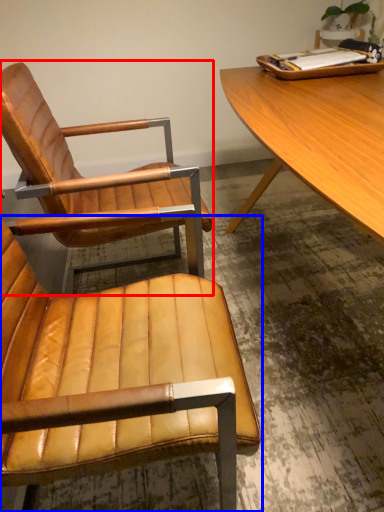
Question: Which object is further to the camera taking this photo, chair (highlighted by a red box) or chair (highlighted by a blue box)?

Choices:
 (A) chair
 (B) chair

Answer: (A)